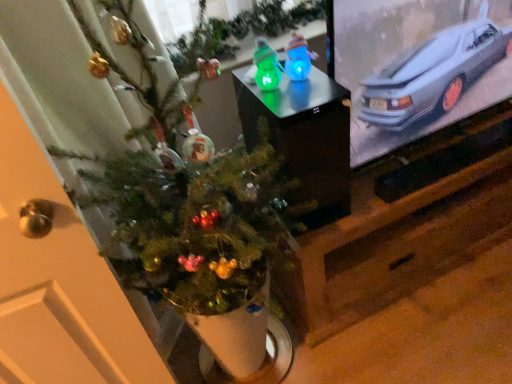
I want to click on vacant area on top of glossy plastic snowmen at center (from a real-world perspective), so click(x=303, y=87).